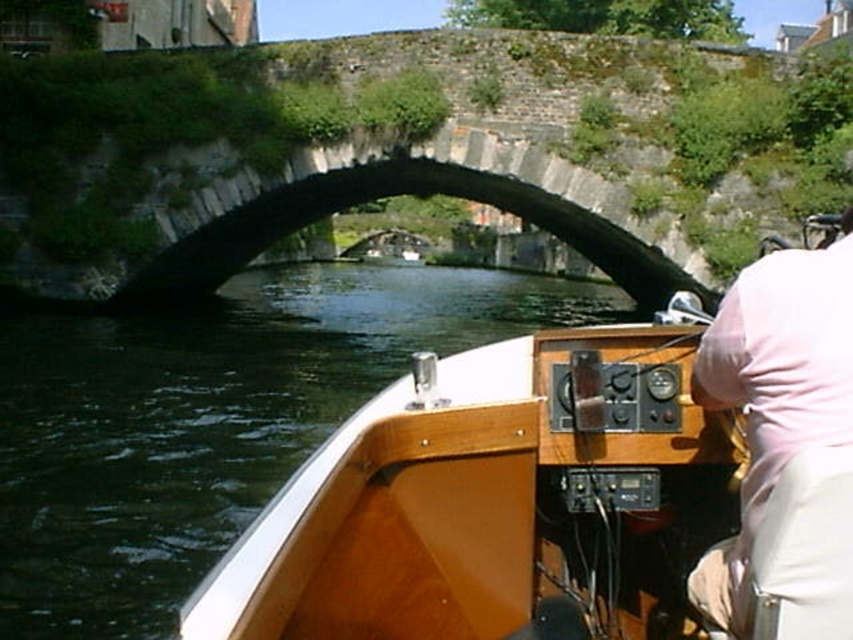
Can you confirm if wooden boat at center is positioned above pink fabric shirt at right?

Actually, wooden boat at center is below pink fabric shirt at right.

The width and height of the screenshot is (853, 640). Describe the element at coordinates (496, 500) in the screenshot. I see `wooden boat at center` at that location.

The image size is (853, 640). Identify the location of wooden boat at center. (496, 500).

Can you confirm if wooden boat at center is bigger than dark gray stone bridge at center?

No.

Can you confirm if wooden boat at center is positioned to the right of dark gray stone bridge at center?

Indeed, wooden boat at center is positioned on the right side of dark gray stone bridge at center.

Is point (688, 321) farther from viewer compared to point (635, 237)?

No, (688, 321) is closer to viewer.

The width and height of the screenshot is (853, 640). I want to click on wooden boat at center, so click(496, 500).

Does point (218, 282) lie in front of point (752, 458)?

No, it is not.

Describe the element at coordinates (399, 195) in the screenshot. Image resolution: width=853 pixels, height=640 pixels. I see `dark gray stone bridge at center` at that location.

The image size is (853, 640). I want to click on dark gray stone bridge at center, so (x=399, y=195).

Find the location of `dark gray stone bridge at center`. dark gray stone bridge at center is located at coordinates (399, 195).